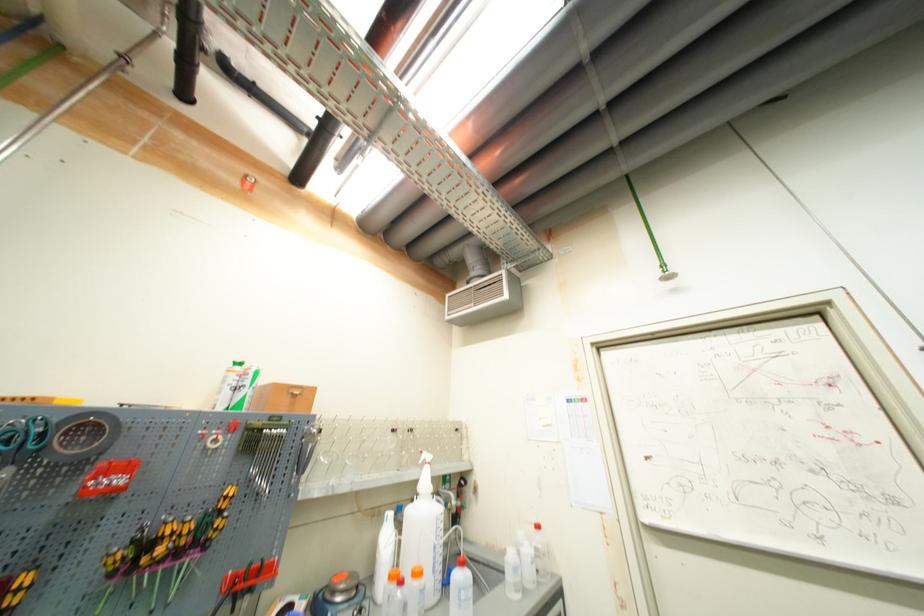
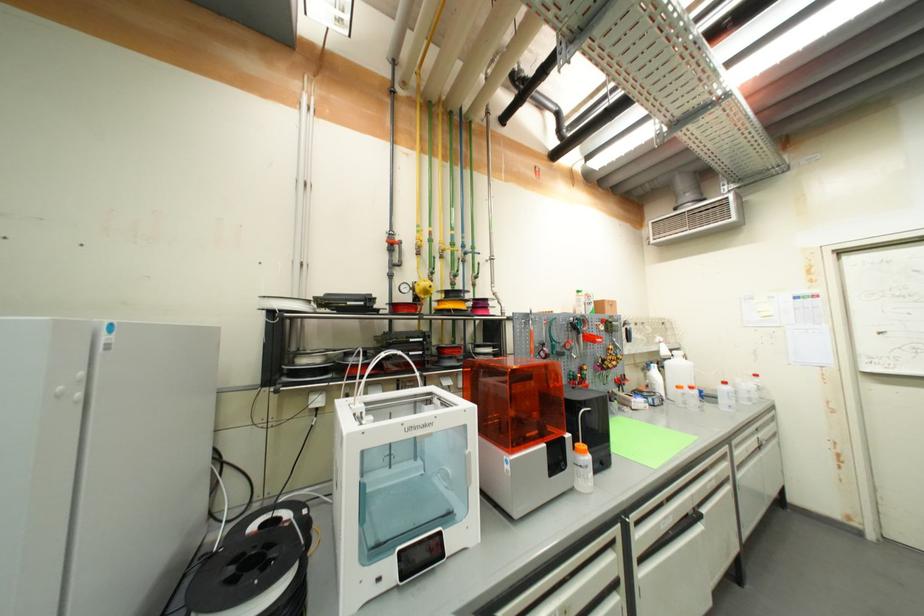
The images are taken continuously from a first-person perspective. In which direction are you moving?

The cameraman walked toward left, backward.